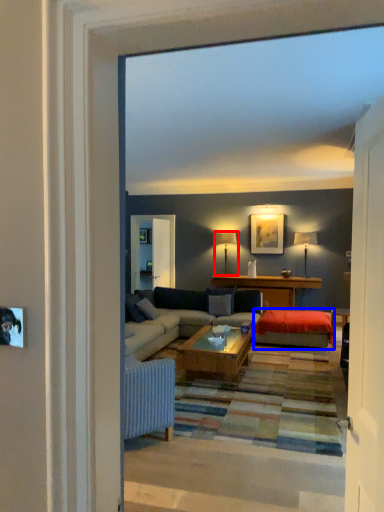
Question: Which object appears closest to the camera in this image, lamp (highlighted by a red box) or wide (highlighted by a blue box)?

Choices:
 (A) lamp
 (B) wide

Answer: (B)